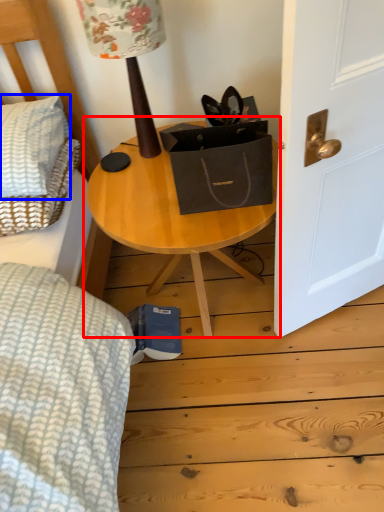
Question: Which object appears closest to the camera in this image, table (highlighted by a red box) or pillow (highlighted by a blue box)?

Choices:
 (A) table
 (B) pillow

Answer: (A)